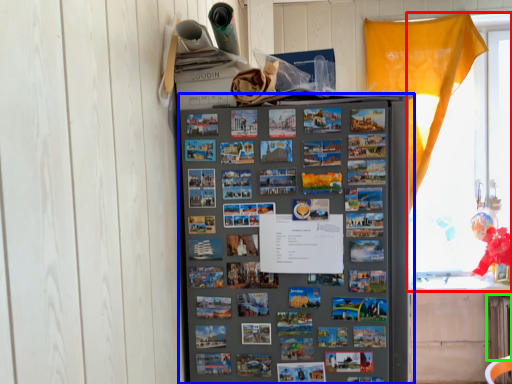
Question: Which is nearer to the window (highlighted by a red box)? refrigerator (highlighted by a blue box) or radiator (highlighted by a green box).

Choices:
 (A) refrigerator
 (B) radiator

Answer: (B)